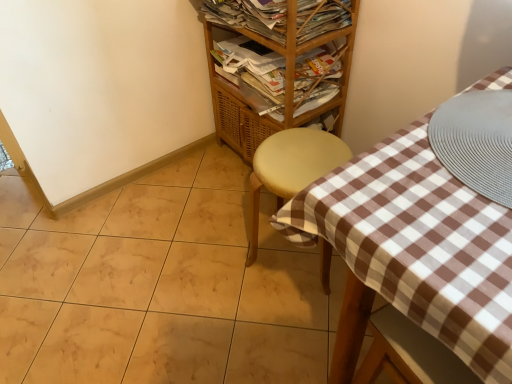
I want to click on free spot below matte yellow stool at center (from a real-world perspective), so click(x=294, y=255).